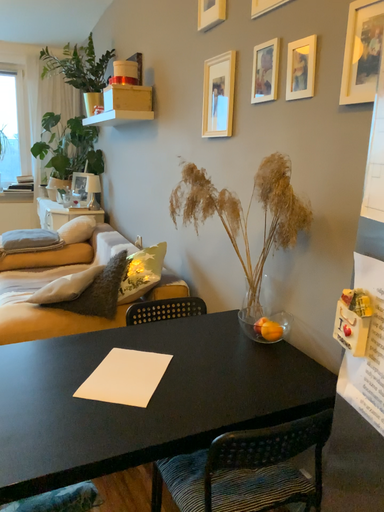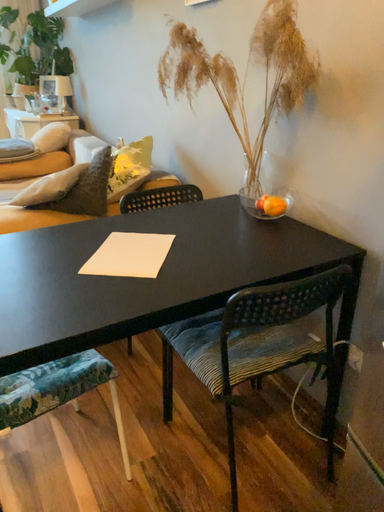
Question: Which way did the camera rotate in the video?

Choices:
 (A) rotated downward
 (B) rotated upward

Answer: (A)